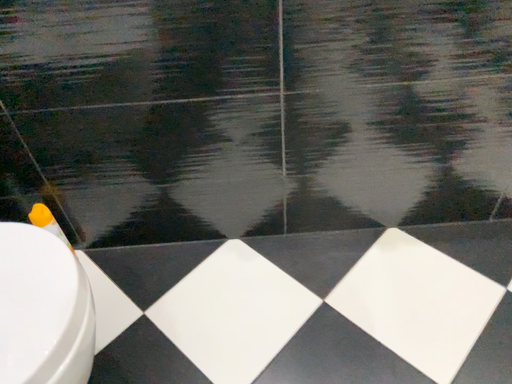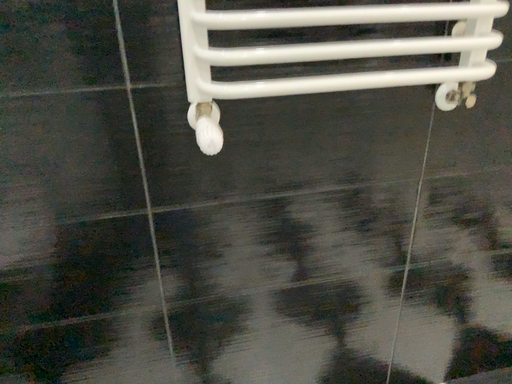
Question: How did the camera likely rotate when shooting the video?

Choices:
 (A) rotated right
 (B) rotated left

Answer: (A)